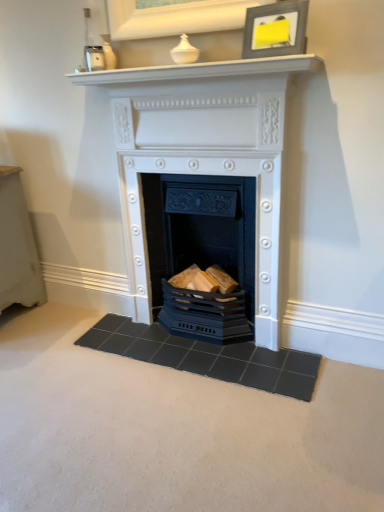
Question: Does matte black picture frame at upper center have a greater height compared to dark gray tile doormat at center?

Choices:
 (A) yes
 (B) no

Answer: (A)

Question: Can you confirm if matte black picture frame at upper center is positioned to the left of dark gray tile doormat at center?

Choices:
 (A) no
 (B) yes

Answer: (A)

Question: Can we say matte black picture frame at upper center lies outside dark gray tile doormat at center?

Choices:
 (A) no
 (B) yes

Answer: (B)

Question: Can you confirm if matte black picture frame at upper center is bigger than dark gray tile doormat at center?

Choices:
 (A) no
 (B) yes

Answer: (A)

Question: From the image's perspective, is matte black picture frame at upper center under dark gray tile doormat at center?

Choices:
 (A) yes
 (B) no

Answer: (B)

Question: Is point (286, 48) positioned closer to the camera than point (190, 348)?

Choices:
 (A) closer
 (B) farther

Answer: (A)

Question: In terms of size, does matte black picture frame at upper center appear bigger or smaller than dark gray tile doormat at center?

Choices:
 (A) small
 (B) big

Answer: (A)

Question: Is matte black picture frame at upper center to the left or to the right of dark gray tile doormat at center in the image?

Choices:
 (A) left
 (B) right

Answer: (B)

Question: Looking at their shapes, would you say matte black picture frame at upper center is wider or thinner than dark gray tile doormat at center?

Choices:
 (A) thin
 (B) wide

Answer: (A)

Question: Is matte black fireplace at center, placed as the 1th fireplace when sorted from bottom to top, wider or thinner than white matte fireplace at center, the second fireplace ordered from the bottom?

Choices:
 (A) thin
 (B) wide

Answer: (B)

Question: Is point (221, 215) positioned closer to the camera than point (170, 262)?

Choices:
 (A) closer
 (B) farther

Answer: (A)

Question: Considering their positions, is matte black fireplace at center, the 2th fireplace from the top, located in front of or behind white matte fireplace at center, the second fireplace ordered from the bottom?

Choices:
 (A) front
 (B) behind

Answer: (B)

Question: From a real-world perspective, is matte black fireplace at center, placed as the 1th fireplace when sorted from bottom to top, physically located above or below white matte fireplace at center, marked as the 1th fireplace in a top-to-bottom arrangement?

Choices:
 (A) above
 (B) below

Answer: (B)

Question: Is point (278, 73) closer or farther from the camera than point (288, 38)?

Choices:
 (A) farther
 (B) closer

Answer: (A)

Question: Would you say white glossy mantle at upper center is to the left or to the right of matte black picture frame at upper center in the picture?

Choices:
 (A) left
 (B) right

Answer: (A)